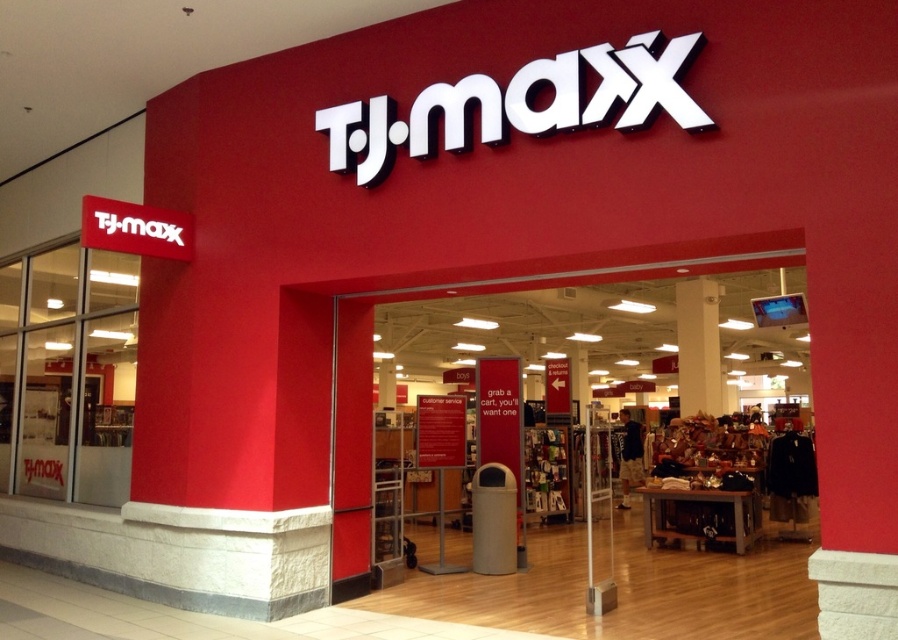
Does wooden table at center appear on the right side of white glossy pillar at upper center?

No, wooden table at center is not to the right of white glossy pillar at upper center.

Is wooden table at center positioned in front of white glossy pillar at upper center?

Yes, wooden table at center is in front of white glossy pillar at upper center.

You are a GUI agent. You are given a task and a screenshot of the screen. Output one action in this format:
    pyautogui.click(x=<x>, y=<y>)
    Task: Click on the wooden table at center
    
    Given the screenshot: What is the action you would take?
    pyautogui.click(x=577, y=426)